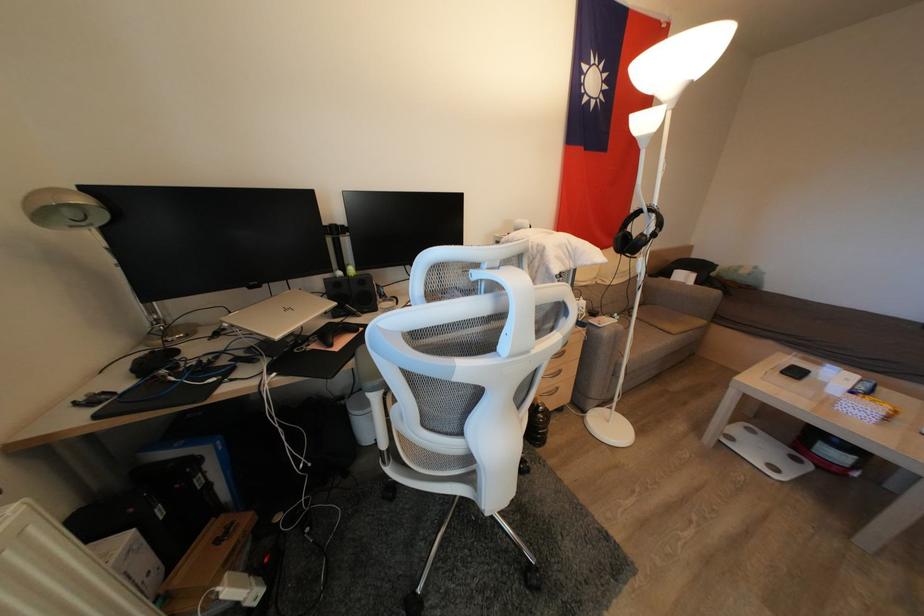
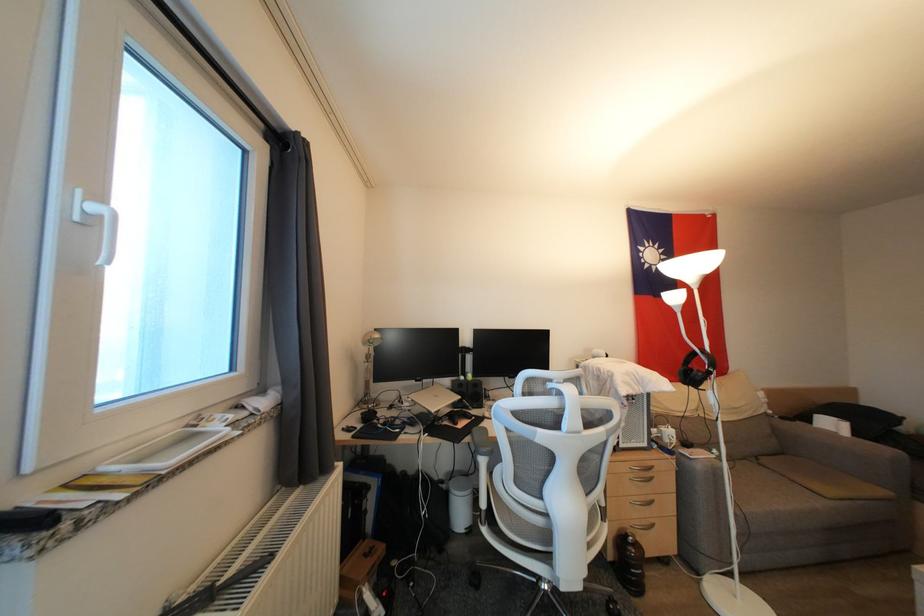
Locate, in the second image, the point that corresponds to pixel 643 216 in the first image.

(699, 357)